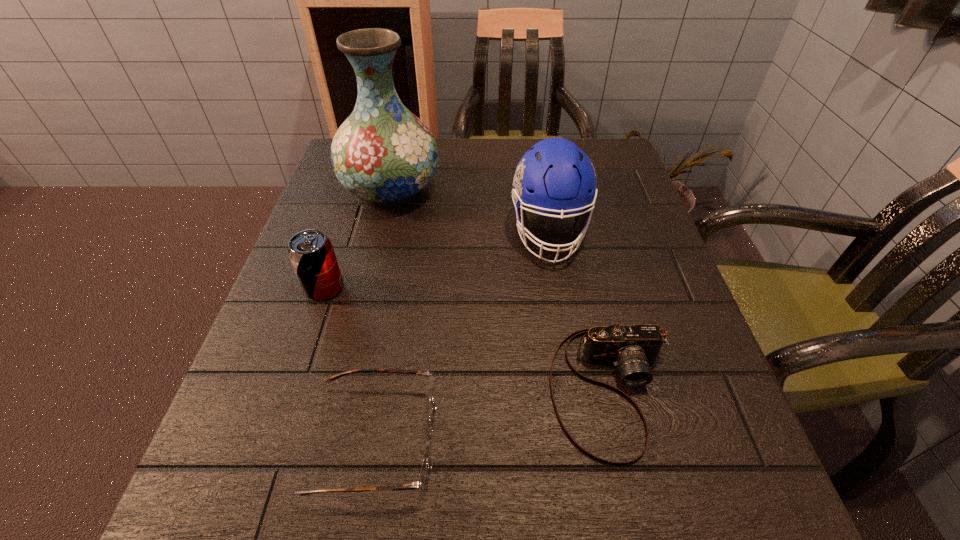
Find the location of `vase`. vase is located at coordinates (383, 153).

Image resolution: width=960 pixels, height=540 pixels. What are the coordinates of `football helmet` in the screenshot? It's located at (554, 176).

Find the location of a particular element. Image resolution: width=960 pixels, height=540 pixels. soda can is located at coordinates (311, 253).

This screenshot has width=960, height=540. What are the coordinates of `the third tallest object` in the screenshot? It's located at (311, 253).

Identify the location of the second shortest object. (632, 348).

At what (x,y) coordinates should I click in order to perform the action: click on the shortest object. Please return your answer as a coordinate pair (x, y). Looking at the image, I should click on (426, 470).

At what (x,y) coordinates should I click in order to perform the action: click on free spot located 0.160m on the right of the tallest object. Please return your answer as a coordinate pair (x, y). The width and height of the screenshot is (960, 540). Looking at the image, I should click on (506, 189).

The height and width of the screenshot is (540, 960). What are the coordinates of `free point located 0.300m on the face guard of the football helmet` in the screenshot? It's located at (579, 409).

The image size is (960, 540). Identify the location of free location located 0.170m on the right of the soda can. 432,288.

The width and height of the screenshot is (960, 540). In order to click on free point located on the front-facing side of the camera in this screenshot , I will do `click(639, 512)`.